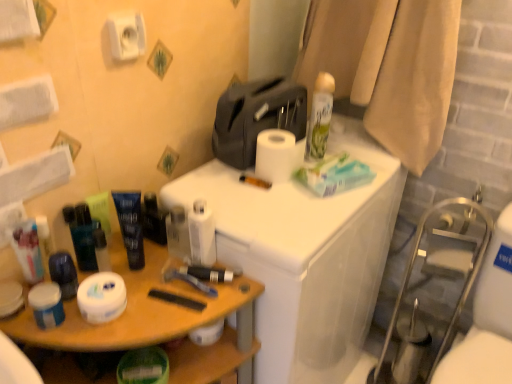
Identify the location of vacant space in between white glossy toilet paper at center, marked as the 2th toilet paper in a right-to-left arrangement, and white matte toilet paper at lower left, the 1th toilet paper positioned from the bottom. (153, 289).